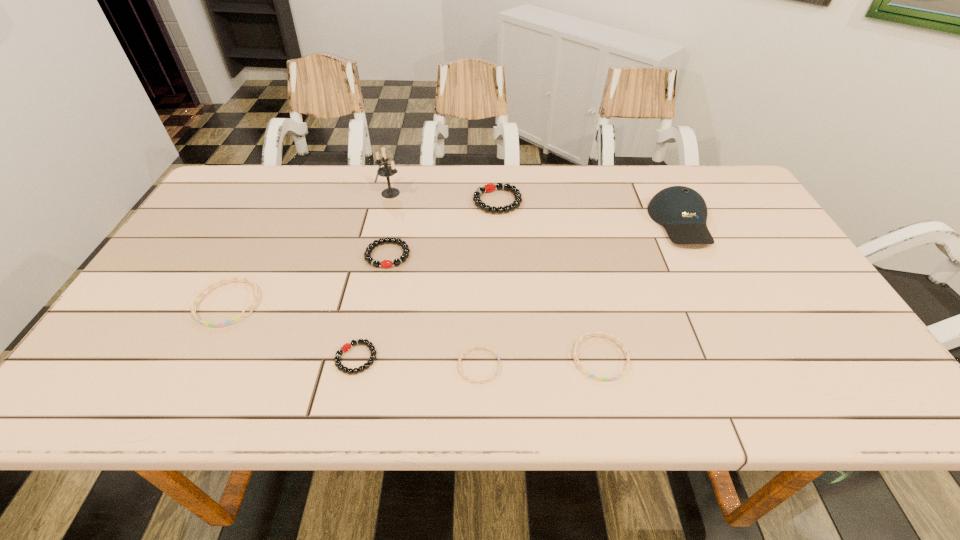
Identify the location of vacant space at the right edge. The height and width of the screenshot is (540, 960). (834, 356).

The height and width of the screenshot is (540, 960). Find the location of `free location at the near left corner of the desktop`. free location at the near left corner of the desktop is located at coordinates (110, 407).

Image resolution: width=960 pixels, height=540 pixels. Find the location of `empty space between the second farthest black bracelet and the candle holder`. empty space between the second farthest black bracelet and the candle holder is located at coordinates (389, 224).

Where is `free point between the shortest bracelet and the nearest black bracelet`? This screenshot has width=960, height=540. free point between the shortest bracelet and the nearest black bracelet is located at coordinates (418, 362).

The width and height of the screenshot is (960, 540). Find the location of `vacant area that lies between the candle holder and the second smallest black bracelet`. vacant area that lies between the candle holder and the second smallest black bracelet is located at coordinates 389,224.

The image size is (960, 540). I want to click on free space between the second farthest black bracelet and the tallest object, so click(x=389, y=224).

Where is `empty space between the biggest black bracelet and the second nearest black bracelet`? This screenshot has width=960, height=540. empty space between the biggest black bracelet and the second nearest black bracelet is located at coordinates (443, 228).

What are the coordinates of `vacant space that's between the smallest black bracelet and the third farthest bracelet` in the screenshot? It's located at (292, 331).

You are a GUI agent. You are given a task and a screenshot of the screen. Output one action in this format:
    pyautogui.click(x=<x>, y=<y>)
    Task: Click on the free area in between the second tallest object and the farthest blue bracelet
    The width and height of the screenshot is (960, 540).
    Given the screenshot: What is the action you would take?
    coord(454,263)

Locate an element on the screen. This screenshot has height=540, width=960. empty location between the nearest black bracelet and the seventh object from left to right is located at coordinates (478, 358).